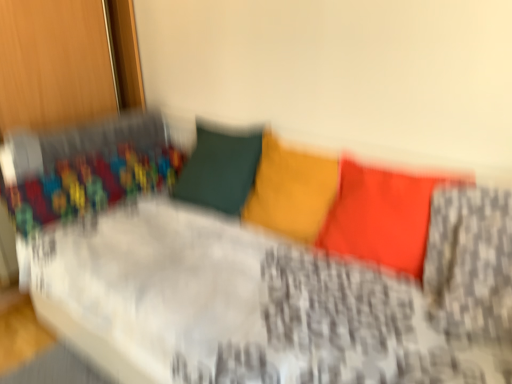
Question: Based on their positions, is matte yellow pillow at center, which ranks as the second pillow in right-to-left order, located to the left or right of matte orange pillow at center, which is counted as the 2th pillow, starting from the left?

Choices:
 (A) left
 (B) right

Answer: (A)

Question: Is point (273, 160) positioned closer to the camera than point (348, 254)?

Choices:
 (A) farther
 (B) closer

Answer: (A)

Question: Looking at the image, does matte yellow pillow at center, which ranks as the second pillow in right-to-left order, seem bigger or smaller compared to matte orange pillow at center, the 1th pillow viewed from the right?

Choices:
 (A) small
 (B) big

Answer: (A)

Question: From a real-world perspective, is matte orange pillow at center, the 1th pillow viewed from the right, physically located above or below matte yellow pillow at center, placed as the 1th pillow when sorted from left to right?

Choices:
 (A) above
 (B) below

Answer: (A)

Question: Considering the relative positions of matte orange pillow at center, which is counted as the 2th pillow, starting from the left, and matte yellow pillow at center, which ranks as the second pillow in right-to-left order, in the image provided, is matte orange pillow at center, which is counted as the 2th pillow, starting from the left, to the left or to the right of matte yellow pillow at center, which ranks as the second pillow in right-to-left order,?

Choices:
 (A) left
 (B) right

Answer: (B)

Question: Which is correct: matte orange pillow at center, the 1th pillow viewed from the right, is inside matte yellow pillow at center, placed as the 1th pillow when sorted from left to right, or outside of it?

Choices:
 (A) outside
 (B) inside

Answer: (A)

Question: Looking at their shapes, would you say matte orange pillow at center, which is counted as the 2th pillow, starting from the left, is wider or thinner than matte yellow pillow at center, which ranks as the second pillow in right-to-left order?

Choices:
 (A) thin
 (B) wide

Answer: (A)